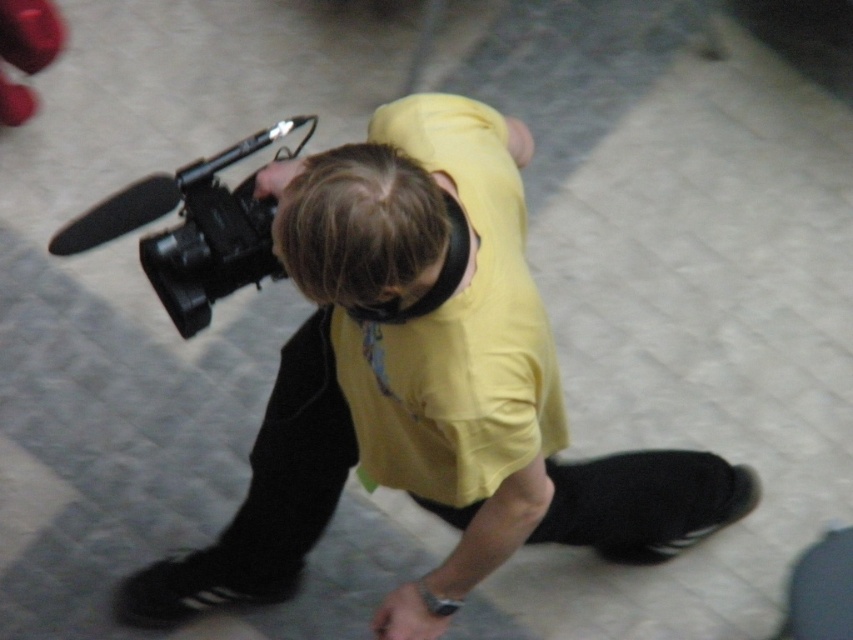
Does black matte camera at center have a larger size compared to black matte video camera at center?

Correct, black matte camera at center is larger in size than black matte video camera at center.

Does black matte camera at center have a lesser height compared to black matte video camera at center?

In fact, black matte camera at center may be taller than black matte video camera at center.

Describe the element at coordinates (426, 385) in the screenshot. I see `black matte camera at center` at that location.

Locate an element on the screen. Image resolution: width=853 pixels, height=640 pixels. black matte camera at center is located at coordinates (426, 385).